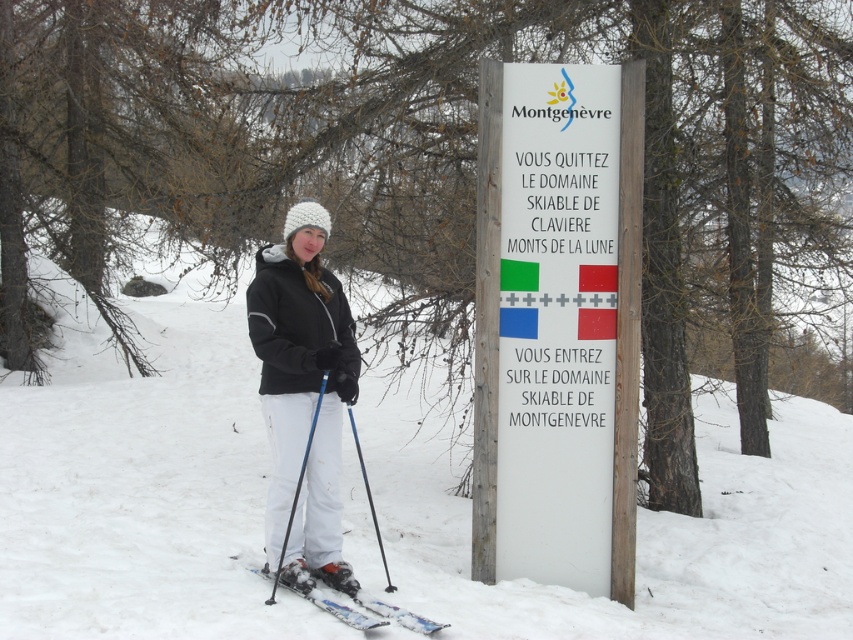
Can you confirm if white fleece jacket at center is positioned below blue plastic ski pole at lower center?

No, white fleece jacket at center is not below blue plastic ski pole at lower center.

Who is taller, white fleece jacket at center or blue plastic ski pole at lower center?

white fleece jacket at center is taller.

Identify the location of white fleece jacket at center. (303, 394).

Consider the image. Is white fleece jacket at center taller than black plastic ski pole at center?

Indeed, white fleece jacket at center has a greater height compared to black plastic ski pole at center.

Does white fleece jacket at center have a greater width compared to black plastic ski pole at center?

Correct, the width of white fleece jacket at center exceeds that of black plastic ski pole at center.

Which is behind, point (310, 481) or point (363, 477)?

The point (363, 477) is more distant.

I want to click on white fleece jacket at center, so coord(303,394).

Does white powder snow at center have a larger size compared to white plastic ski at lower center?

Yes.

Between white powder snow at center and white plastic ski at lower center, which one appears on the left side from the viewer's perspective?

From the viewer's perspective, white plastic ski at lower center appears more on the left side.

Consider the image. Who is more forward, (405,420) or (291,570)?

Point (291,570)

Locate an element on the screen. white powder snow at center is located at coordinates (141, 484).